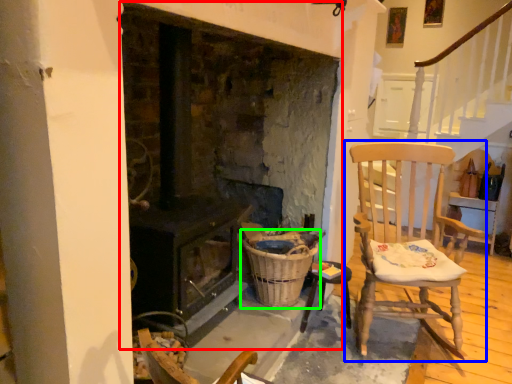
Question: Based on their relative distances, which object is farther from fireplace (highlighted by a red box)? Choose from chair (highlighted by a blue box) and basket (highlighted by a green box).

Choices:
 (A) chair
 (B) basket

Answer: (A)